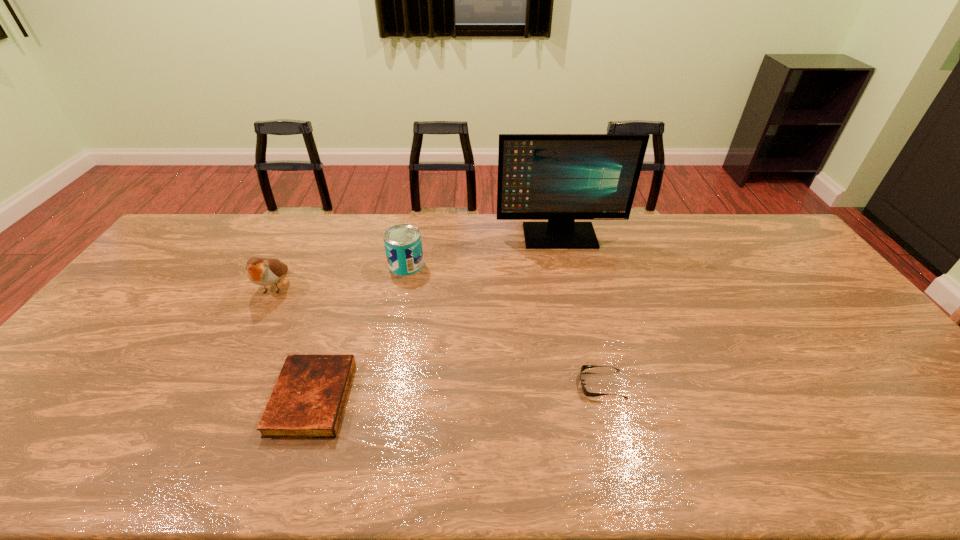
In the image, there is a desktop. In order to click on free space at the right edge in this screenshot , I will do `click(882, 406)`.

You are a GUI agent. You are given a task and a screenshot of the screen. Output one action in this format:
    pyautogui.click(x=<x>, y=<y>)
    Task: Click on the vacant area at the far right corner of the desktop
    Image resolution: width=960 pixels, height=540 pixels.
    Given the screenshot: What is the action you would take?
    click(x=748, y=246)

You are a GUI agent. You are given a task and a screenshot of the screen. Output one action in this format:
    pyautogui.click(x=<x>, y=<y>)
    Task: Click on the free space between the Bible and the farthest object
    
    Given the screenshot: What is the action you would take?
    pyautogui.click(x=436, y=317)

Locate an element on the screen. Image resolution: width=960 pixels, height=540 pixels. empty space that is in between the third object from right to left and the Bible is located at coordinates (359, 332).

At what (x,y) coordinates should I click in order to perform the action: click on free point between the leftmost object and the third shortest object. Please return your answer as a coordinate pair (x, y). This screenshot has height=540, width=960. Looking at the image, I should click on (340, 276).

Locate an element on the screen. empty space that is in between the Bible and the third object from left to right is located at coordinates (359, 332).

You are a GUI agent. You are given a task and a screenshot of the screen. Output one action in this format:
    pyautogui.click(x=<x>, y=<y>)
    Task: Click on the unoccupied area between the third object from right to left and the fourth shortest object
    Image resolution: width=960 pixels, height=540 pixels.
    Given the screenshot: What is the action you would take?
    pyautogui.click(x=340, y=276)

Image resolution: width=960 pixels, height=540 pixels. In order to click on vacant area that lies between the third shortest object and the tallest object in this screenshot , I will do `click(483, 251)`.

I want to click on vacant point located between the tallest object and the fourth object from right to left, so click(436, 317).

You are a GUI agent. You are given a task and a screenshot of the screen. Output one action in this format:
    pyautogui.click(x=<x>, y=<y>)
    Task: Click on the empty location between the can and the shortest object
    
    Given the screenshot: What is the action you would take?
    pyautogui.click(x=504, y=325)